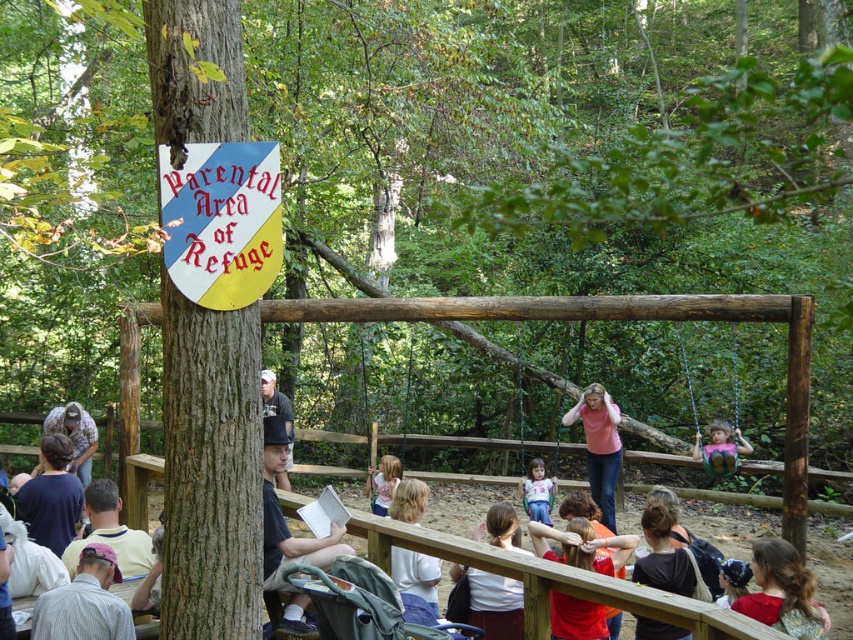
Question: Is brown rough bark tree at left thinner than light pink fabric dress at center?

Choices:
 (A) no
 (B) yes

Answer: (B)

Question: Can you confirm if yellow and blue shield at upper left is wider than matte black shirt at upper center?

Choices:
 (A) yes
 (B) no

Answer: (A)

Question: Estimate the real-world distances between objects in this image. Which object is closer to the matte pink shirt at center?

Choices:
 (A) pink matte shirt at center
 (B) brown rough bark tree at left
 (C) light pink fabric dress at center
 (D) yellow and blue shield at upper left

Answer: (A)

Question: Does matte pink swing at center appear on the left side of light pink fabric dress at center?

Choices:
 (A) yes
 (B) no

Answer: (B)

Question: Which point is farther from the camera taking this photo?

Choices:
 (A) (583, 429)
 (B) (218, 198)
 (C) (727, 449)
 (D) (546, 483)

Answer: (A)

Question: Which point is closer to the camera?

Choices:
 (A) (270, 252)
 (B) (395, 477)
 (C) (195, 68)
 (D) (714, 442)

Answer: (C)